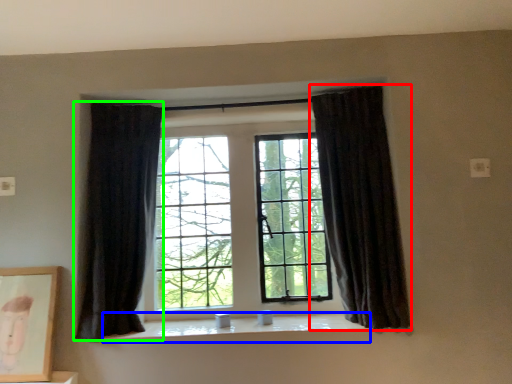
Question: Which is nearer to the curtain (highlighted by a red box)? window sill (highlighted by a blue box) or curtain (highlighted by a green box).

Choices:
 (A) window sill
 (B) curtain

Answer: (A)